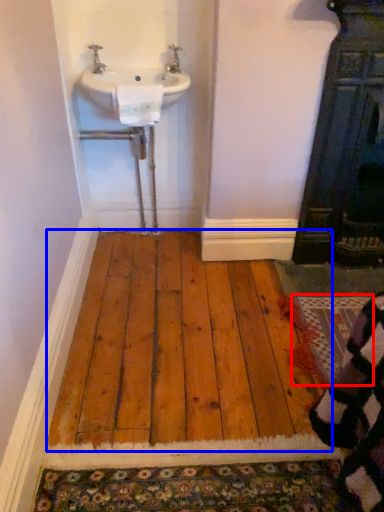
Question: Which object is further to the camera taking this photo, doormat (highlighted by a red box) or hardwood (highlighted by a blue box)?

Choices:
 (A) doormat
 (B) hardwood

Answer: (A)